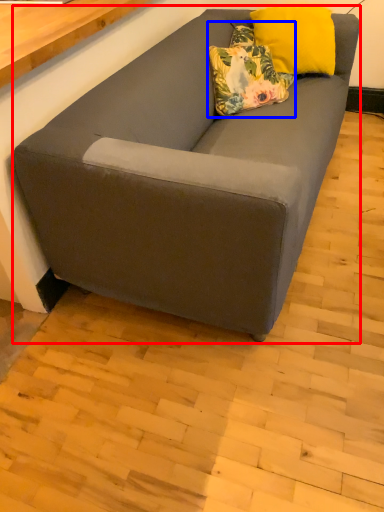
Question: Which point is closer to the camera, studio couch (highlighted by a red box) or pillow (highlighted by a blue box)?

Choices:
 (A) studio couch
 (B) pillow

Answer: (A)